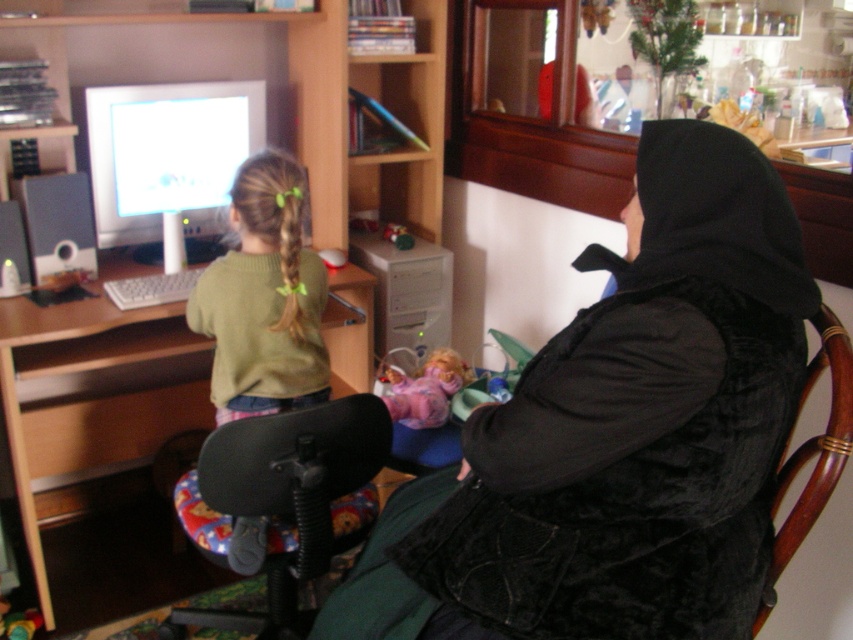
You are a delivery robot that needs to place a small package between the wooden desk at lower left and the green sweater at left. Can you fit the package there if it measures 18 inches in length?

The space between the wooden desk at lower left and the green sweater at left is 17.82 inches. Since the package is 18 inches long, it won,t fit as it is slightly longer than the available space.

You are a tailor who needs to determine which clothing item requires more fabric based on their height. Given the black velvet vest at center and the green sweater at left, which one would need more fabric?

The black velvet vest at center requires more fabric because it has a greater height compared to the green sweater at left.